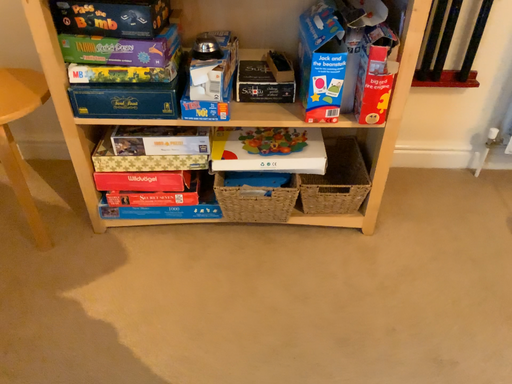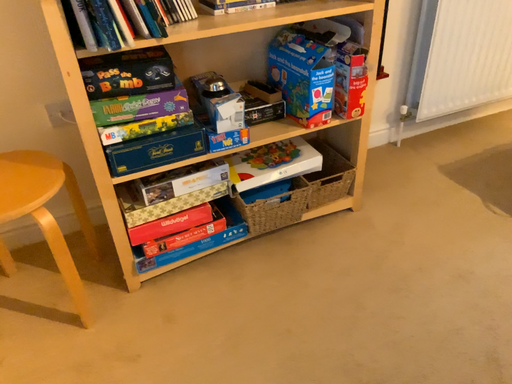
Question: How did the camera likely rotate when shooting the video?

Choices:
 (A) rotated downward
 (B) rotated upward

Answer: (B)